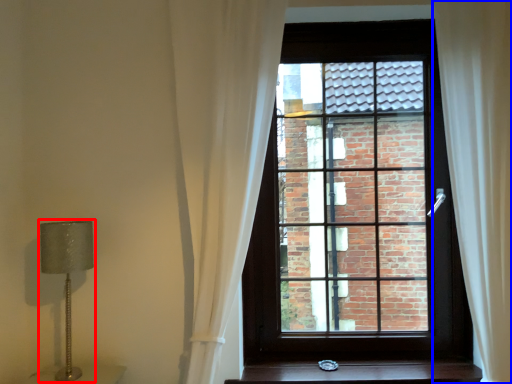
Question: Which object appears farthest to the camera in this image, table lamp (highlighted by a red box) or curtain (highlighted by a blue box)?

Choices:
 (A) table lamp
 (B) curtain

Answer: (A)